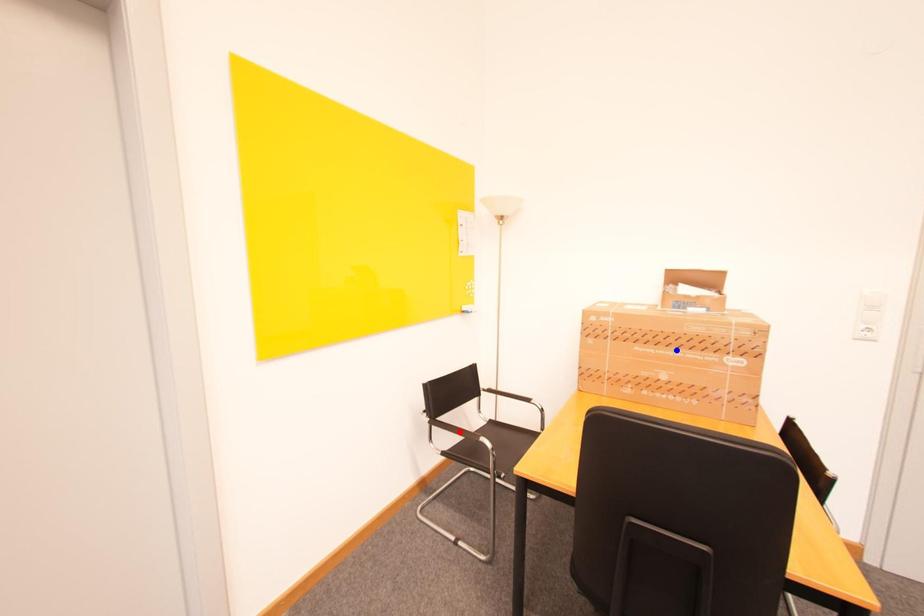
Question: Which of the two points in the image is closer to the camera?

Choices:
 (A) Blue point is closer.
 (B) Red point is closer.

Answer: (A)